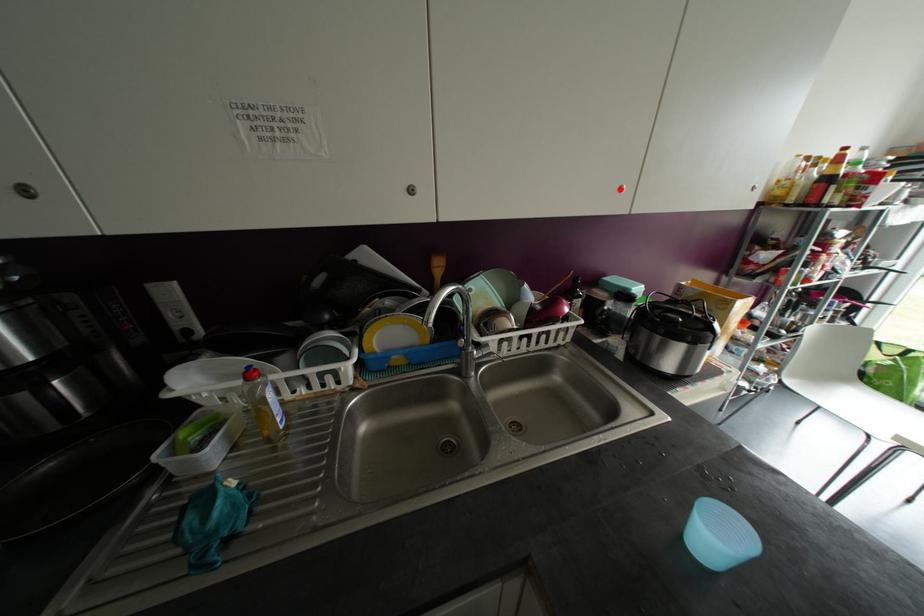
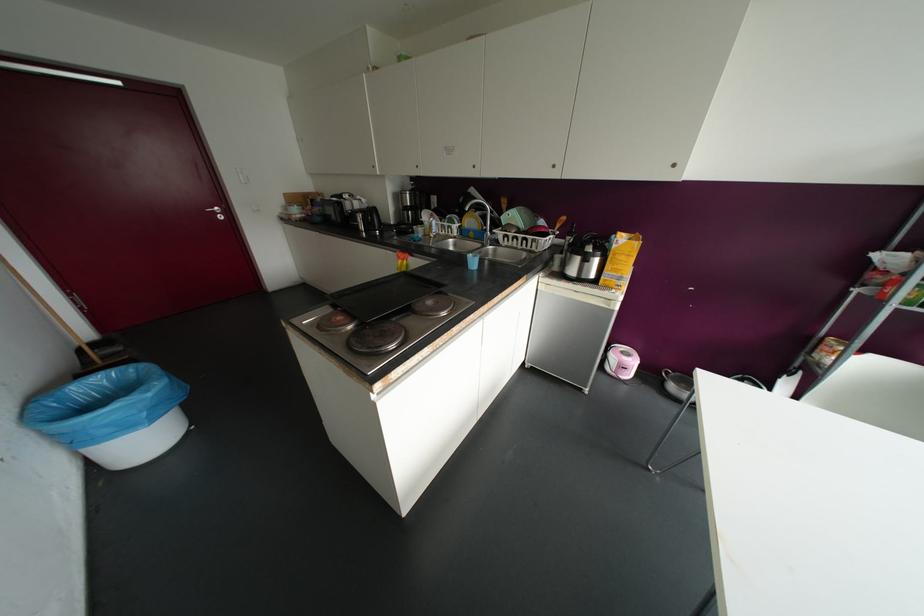
Find the pixel in the second image that matches the highlighted location in the first image.

(553, 166)